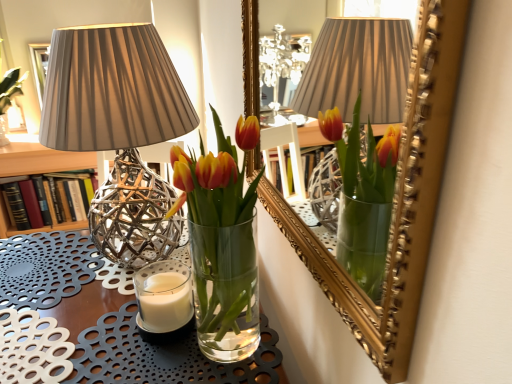
Describe the element at coordinates (60, 205) in the screenshot. I see `hardcover book at left` at that location.

What do you see at coordinates (165, 302) in the screenshot? The width and height of the screenshot is (512, 384). I see `white wax candle at lower left` at bounding box center [165, 302].

Find the location of a particular element. white wax candle at lower left is located at coordinates (165, 302).

What do you see at coordinates (106, 320) in the screenshot?
I see `clear glass vase at center` at bounding box center [106, 320].

Identify the location of translucent glass vase at center. coord(222,241).

Is the surface of translucent glass vase at center in direct contact with hardcover book at left?

No, translucent glass vase at center is not next to hardcover book at left.

Is translucent glass vase at center oriented towards hardcover book at left?

No, translucent glass vase at center is not turned towards hardcover book at left.

From the image's perspective, is translucent glass vase at center above hardcover book at left?

No, from the image's perspective, translucent glass vase at center is not over hardcover book at left.

Is point (240, 278) closer to viewer compared to point (57, 181)?

That is True.

Based on their sizes in the image, would you say white wax candle at lower left is bigger or smaller than hardcover book at left?

Clearly, white wax candle at lower left is smaller in size than hardcover book at left.

Is white wax candle at lower left directly adjacent to hardcover book at left?

No, white wax candle at lower left is not beside hardcover book at left.

Is white wax candle at lower left aimed at hardcover book at left?

No, white wax candle at lower left does not turn towards hardcover book at left.

Does translucent glass vase at center have a lesser height compared to clear glass vase at center?

Yes, translucent glass vase at center is shorter than clear glass vase at center.

Is translucent glass vase at center far away from clear glass vase at center?

No, there isn't a large distance between translucent glass vase at center and clear glass vase at center.

Is point (149, 312) more distant than point (117, 325)?

That is False.

Is white wax candle at lower left outside of clear glass vase at center?

Yes, white wax candle at lower left is outside of clear glass vase at center.

Are white wax candle at lower left and clear glass vase at center far apart?

That's not correct — white wax candle at lower left is a little close to clear glass vase at center.

How much distance is there between white wax candle at lower left and clear glass vase at center?

white wax candle at lower left is 6.77 inches from clear glass vase at center.

Could translucent glass vase at center be considered to be inside clear glass vase at center?

No, translucent glass vase at center is not a part of clear glass vase at center.

Where is `table on the left of the translucent glass vase at center`? This screenshot has width=512, height=384. table on the left of the translucent glass vase at center is located at coordinates (106, 320).

Based on the photo, is clear glass vase at center next to translucent glass vase at center?

No, clear glass vase at center is not in contact with translucent glass vase at center.

Which of these two, clear glass vase at center or matte silver lamp at left, is smaller?

Smaller between the two is matte silver lamp at left.

Is clear glass vase at center directly adjacent to matte silver lamp at left?

No, clear glass vase at center is not with matte silver lamp at left.

Is clear glass vase at center behind matte silver lamp at left?

No, it is not.

Considering the positions of objects clear glass vase at center and matte silver lamp at left in the image provided, who is more to the left, clear glass vase at center or matte silver lamp at left?

From the viewer's perspective, clear glass vase at center appears more on the left side.

Between translucent glass vase at center and matte silver lamp at left, which one has more height?

matte silver lamp at left.

Locate an element on the screen. This screenshot has height=384, width=512. houseplant below the matte silver lamp at left (from the image's perspective) is located at coordinates (222, 241).

Between translucent glass vase at center and matte silver lamp at left, which one is positioned behind?

matte silver lamp at left.

From a real-world perspective, is translucent glass vase at center beneath matte silver lamp at left?

Yes, from a real-world perspective, translucent glass vase at center is beneath matte silver lamp at left.

Where is `houseplant in front of the hardcover book at left`? houseplant in front of the hardcover book at left is located at coordinates (222, 241).

Where is `candle below the hardcover book at left (from the image's perspective)`? candle below the hardcover book at left (from the image's perspective) is located at coordinates (165, 302).

Considering their positions, is matte silver lamp at left positioned further to white wax candle at lower left than hardcover book at left?

The object further to white wax candle at lower left is hardcover book at left.

When comparing their distances from matte silver lamp at left, does translucent glass vase at center or white wax candle at lower left seem closer?

Among the two, translucent glass vase at center is located nearer to matte silver lamp at left.

From the image, which object appears to be farther from translucent glass vase at center, matte silver lamp at left or white wax candle at lower left?

The object further to translucent glass vase at center is matte silver lamp at left.

Which object lies nearer to the anchor point translucent glass vase at center, hardcover book at left or matte silver lamp at left?

matte silver lamp at left is positioned closer to the anchor translucent glass vase at center.

Based on their spatial positions, is white wax candle at lower left or translucent glass vase at center closer to clear glass vase at center?

Among the two, white wax candle at lower left is located nearer to clear glass vase at center.

Which object lies nearer to the anchor point white wax candle at lower left, clear glass vase at center or hardcover book at left?

clear glass vase at center.

From the picture: Based on their spatial positions, is white wax candle at lower left or hardcover book at left further from matte silver lamp at left?

hardcover book at left lies further to matte silver lamp at left than the other object.

Looking at the image, which one is located closer to hardcover book at left, white wax candle at lower left or clear glass vase at center?

clear glass vase at center is closer to hardcover book at left.

This screenshot has width=512, height=384. Identify the location of houseplant between clear glass vase at center and hardcover book at left along the z-axis. (222, 241).

Identify the location of candle between translucent glass vase at center and hardcover book at left in the front-back direction. This screenshot has width=512, height=384. (165, 302).

You are a GUI agent. You are given a task and a screenshot of the screen. Output one action in this format:
    pyautogui.click(x=<x>, y=<y>)
    Task: Click on the candle between matte silver lamp at left and hardcover book at left in the front-back direction
    The width and height of the screenshot is (512, 384).
    Given the screenshot: What is the action you would take?
    pyautogui.click(x=165, y=302)

Where is `candle between matte silver lamp at left and clear glass vase at center in the up-down direction`? Image resolution: width=512 pixels, height=384 pixels. candle between matte silver lamp at left and clear glass vase at center in the up-down direction is located at coordinates (165, 302).